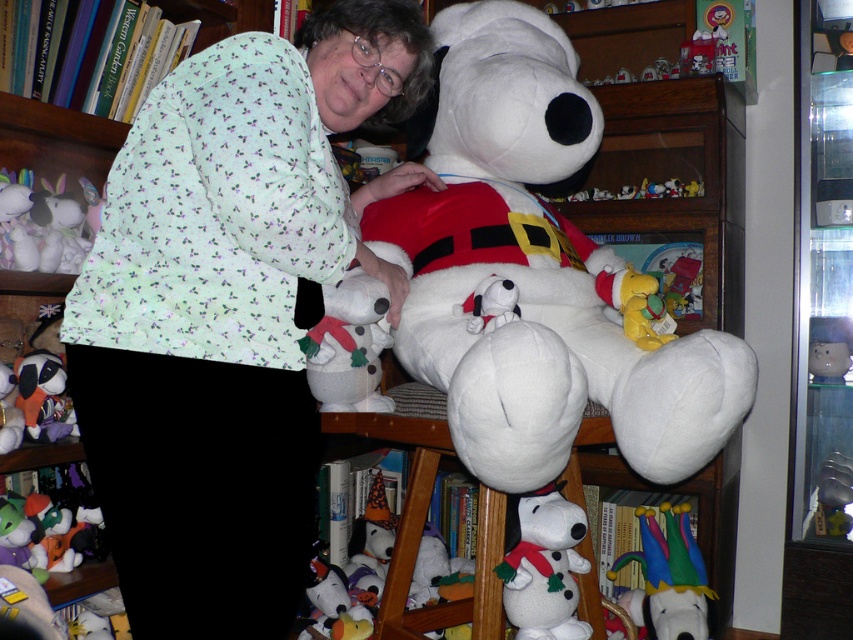
Question: Which of the following is the farthest from the observer?

Choices:
 (A) (309, 593)
 (B) (531, 497)

Answer: (A)

Question: Is light green printed fabric at center thinner than white plush bear at center?

Choices:
 (A) yes
 (B) no

Answer: (A)

Question: Is light green printed fabric at center wider than white plush bear at center?

Choices:
 (A) no
 (B) yes

Answer: (A)

Question: Which object is the closest to the velvet plush dog at lower left?

Choices:
 (A) velvet plush dog at lower center
 (B) white plush bear at center
 (C) light green printed fabric at center
 (D) fluffy white bunny at left

Answer: (D)

Question: Does fluffy white bunny at left appear under velvet plush dog at lower left?

Choices:
 (A) no
 (B) yes

Answer: (A)

Question: Which object is the farthest from the matte plastic cat at upper right?

Choices:
 (A) white plush dog at center
 (B) white plush bear at center
 (C) velvet plush dog at lower left
 (D) fluffy white bunny at left

Answer: (D)